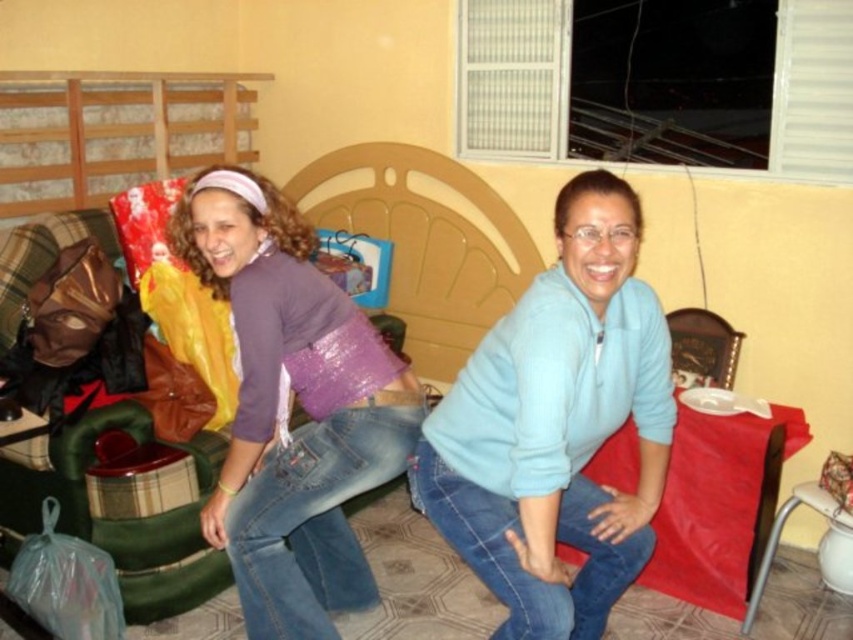
Is point (608, 344) less distant than point (300, 497)?

Yes, point (608, 344) is closer to viewer.

Does point (606, 563) come behind point (251, 250)?

No, (606, 563) is closer to viewer.

This screenshot has width=853, height=640. I want to click on light blue fleece at center, so click(x=556, y=426).